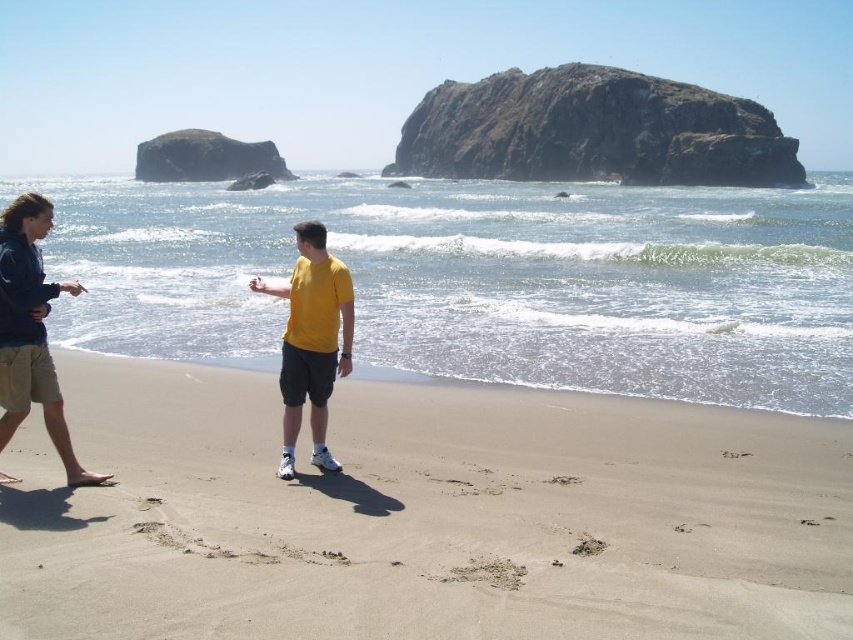
Question: Observing the image, what is the correct spatial positioning of yellow matte shirt at center in reference to brown sandy footprint at lower center?

Choices:
 (A) below
 (B) above

Answer: (B)

Question: Is dark blue cotton shirt at left further to camera compared to brown sandy footprint at lower center?

Choices:
 (A) yes
 (B) no

Answer: (A)

Question: Which point appears closest to the camera in this image?

Choices:
 (A) (65, 541)
 (B) (297, 273)

Answer: (A)

Question: Which of the following is the closest to the observer?

Choices:
 (A) (656, 483)
 (B) (592, 552)

Answer: (B)

Question: Among these objects, which one is nearest to the camera?

Choices:
 (A) brown sandy footprint at lower center
 (B) yellow matte shirt at center
 (C) light brown sand at center
 (D) dark blue cotton shirt at left

Answer: (C)

Question: Is yellow matte shirt at center positioned at the back of brown sandy footprint at lower center?

Choices:
 (A) yes
 (B) no

Answer: (A)